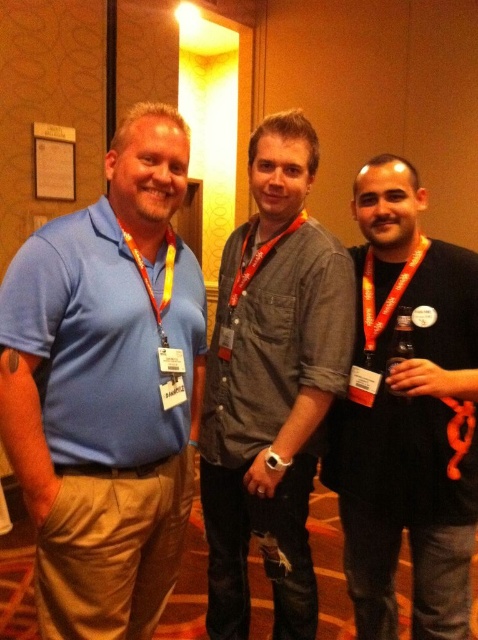
Can you confirm if black matte shirt at right is bigger than gray fabric shirt at center?

Indeed, black matte shirt at right has a larger size compared to gray fabric shirt at center.

Where is `black matte shirt at right`? black matte shirt at right is located at coordinates (408, 419).

Between point (358, 333) and point (293, 161), which one is positioned behind?

The point (358, 333) is more distant.

Is black matte shirt at right below gray cotton shirt at center?

Correct, black matte shirt at right is located below gray cotton shirt at center.

Is point (452, 529) closer to camera compared to point (315, 604)?

That is True.

This screenshot has width=478, height=640. Find the location of `black matte shirt at right`. black matte shirt at right is located at coordinates (408, 419).

Locate an element on the screen. matte blue shirt at left is located at coordinates (107, 388).

Is point (25, 372) positioned behind point (257, 257)?

No, (25, 372) is in front of (257, 257).

Describe the element at coordinates (107, 388) in the screenshot. I see `matte blue shirt at left` at that location.

At what (x,y) coordinates should I click in order to perform the action: click on matte blue shirt at left. Please return your answer as a coordinate pair (x, y). Looking at the image, I should click on (107, 388).